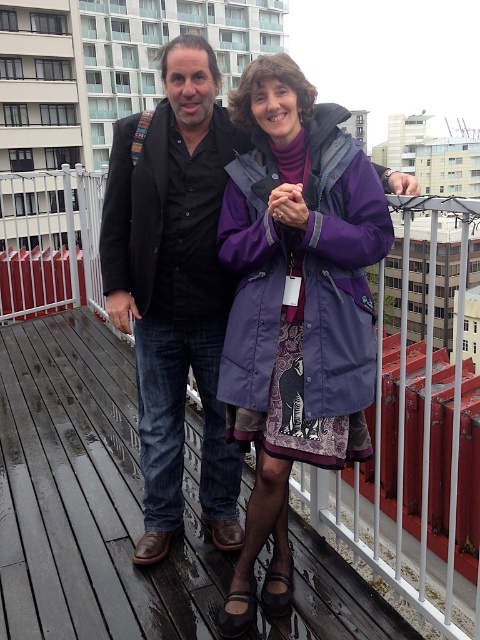
Measure the distance between point (x=152, y=320) and camera.

Point (x=152, y=320) is 3.01 meters from camera.

Does black matte jacket at center have a lesser height compared to black matte coat at center?

Incorrect, black matte jacket at center's height does not fall short of black matte coat at center's.

Find the location of a particular element. black matte jacket at center is located at coordinates (175, 288).

This screenshot has width=480, height=640. I want to click on black matte jacket at center, so click(x=175, y=288).

Is purple matte coat at center bigger than black matte jacket at center?

Yes, purple matte coat at center is bigger than black matte jacket at center.

Which is in front, point (254, 225) or point (223, 540)?

Positioned in front is point (254, 225).

Locate an element on the screen. This screenshot has width=480, height=640. purple matte coat at center is located at coordinates click(295, 307).

Does wooden at center have a smaller size compared to black matte jacket at center?

Incorrect, wooden at center is not smaller in size than black matte jacket at center.

Can you confirm if wooden at center is positioned to the right of black matte jacket at center?

In fact, wooden at center is to the left of black matte jacket at center.

Does point (39, 566) come farther from viewer compared to point (163, 61)?

No, it is not.

The height and width of the screenshot is (640, 480). Find the location of `wooden at center`. wooden at center is located at coordinates (88, 497).